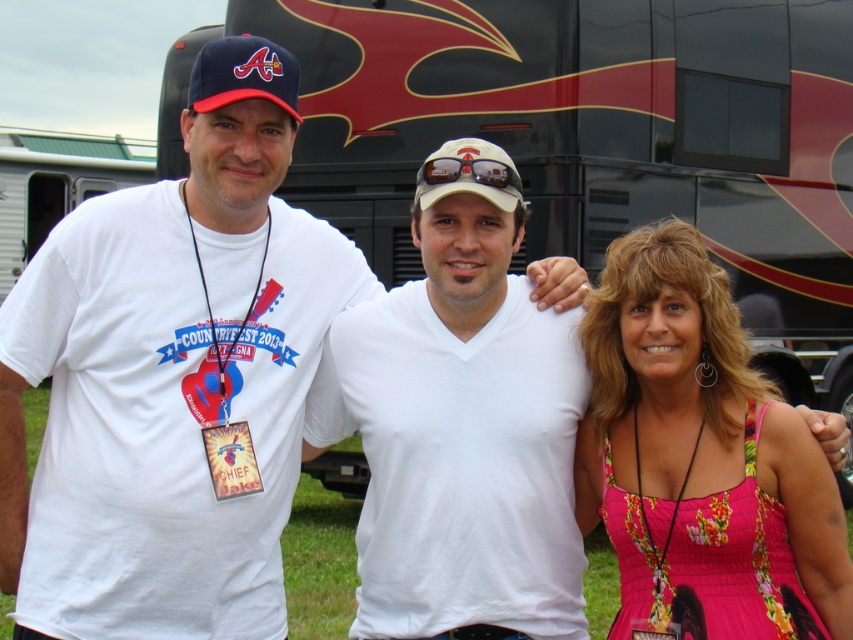
Identify the location of matte blue baseball cap at upper left. The image size is (853, 640). (242, 74).

Is point (224, 40) positioned in front of point (511, 202)?

Yes, point (224, 40) is in front of point (511, 202).

The width and height of the screenshot is (853, 640). What do you see at coordinates (242, 74) in the screenshot?
I see `matte blue baseball cap at upper left` at bounding box center [242, 74].

What are the coordinates of `matte blue baseball cap at upper left` in the screenshot? It's located at (242, 74).

Which is below, black glossy recreational vehicle at upper center or white cotton t-shirt at center?

white cotton t-shirt at center is lower down.

Does black glossy recreational vehicle at upper center appear under white cotton t-shirt at center?

Actually, black glossy recreational vehicle at upper center is above white cotton t-shirt at center.

Where is `black glossy recreational vehicle at upper center`? black glossy recreational vehicle at upper center is located at coordinates (601, 138).

I want to click on black glossy recreational vehicle at upper center, so click(x=601, y=138).

Is floral print dress at center taller than white matte baseball cap at center?

Yes, floral print dress at center is taller than white matte baseball cap at center.

Is floral print dress at center bigger than white matte baseball cap at center?

Yes, floral print dress at center is bigger than white matte baseball cap at center.

Does point (729, 563) come behind point (491, 156)?

No, it is not.

The height and width of the screenshot is (640, 853). Find the location of `floral print dress at center`. floral print dress at center is located at coordinates (703, 456).